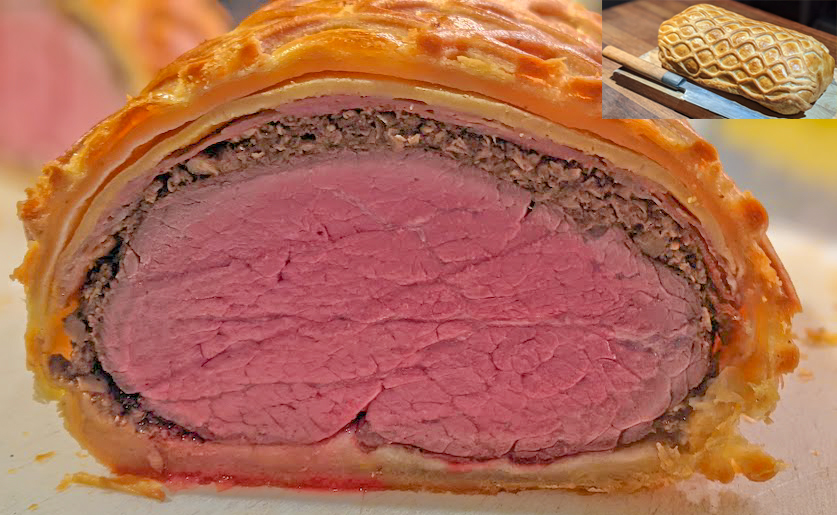
Find the location of a particular element. The image size is (837, 515). serving board is located at coordinates (665, 94), (649, 52).